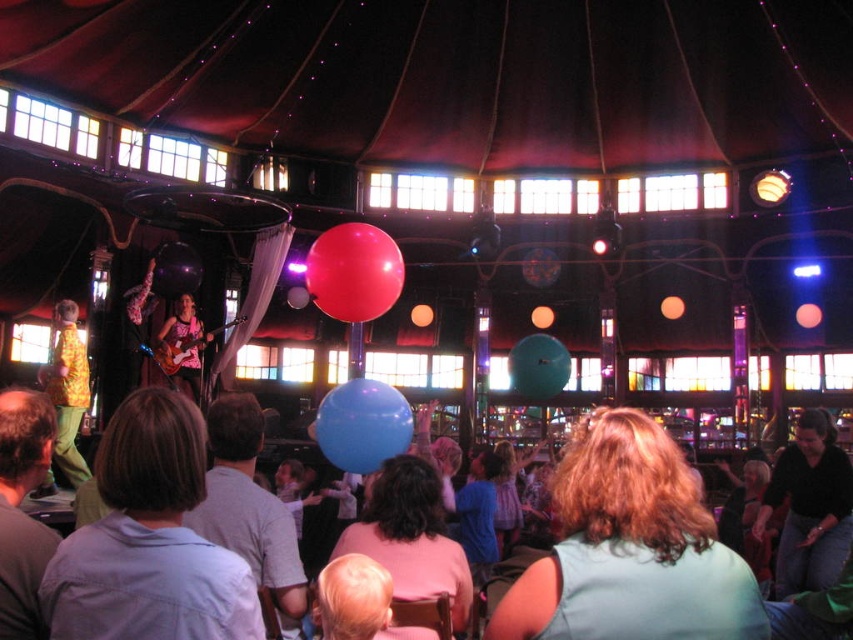
Question: Which point is farther to the camera?

Choices:
 (A) matte pink guitar at center
 (B) black cotton shirt at lower right
 (C) light brown hair at center
 (D) yellow patterned shirt at stage left

Answer: (A)

Question: Does blue rubber balloon at center have a lesser width compared to translucent blue balloon at center?

Choices:
 (A) no
 (B) yes

Answer: (A)

Question: Can you confirm if blue rubber balloon at center is positioned below metallic purple balloon at center?

Choices:
 (A) yes
 (B) no

Answer: (A)

Question: Is light brown hair at center positioned behind yellow patterned shirt at stage left?

Choices:
 (A) yes
 (B) no

Answer: (B)

Question: Which object is positioned farthest from the blue rubber balloon at center?

Choices:
 (A) rubber balloon at center
 (B) matte pink guitar at center

Answer: (B)

Question: Which object is the closest to the rubber balloon at center?

Choices:
 (A) blue rubber balloon at center
 (B) black cotton shirt at lower right
 (C) light brown hair at center

Answer: (A)